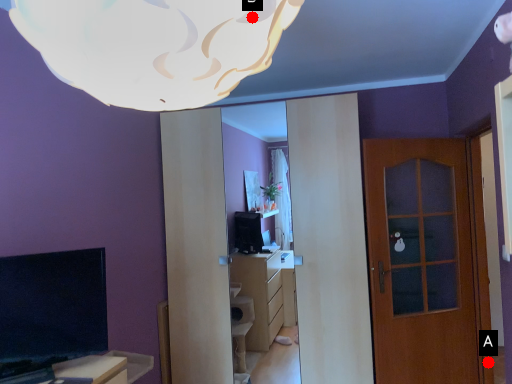
Question: Two points are circled on the image, labeled by A and B beside each circle. Among these points, which one is farthest from the camera?

Choices:
 (A) A is further
 (B) B is further

Answer: (A)